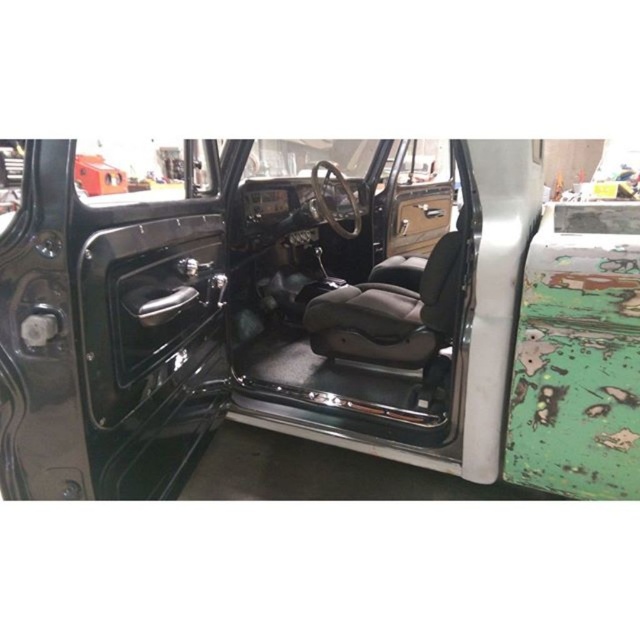
You are a mechanic working on a vintage car and need to replace the seat. The new seat you have is the same size as the current black leather door at center. Will the new seat fit in the space where the matte black seat at center is currently located?

The matte black seat at center is wider than the black leather door at center. Since the new seat is the same size as the door, it will not be wide enough to fit in the space where the matte black seat at center is located.

You are a mechanic working on a vintage car. You need to determine if the matte black seat at center can be replaced with a new seat that is 1.2 meters in width. The current space between the black leather door at center and other structures is 1.5 meters. Can the new seat fit in the space?

The matte black seat at center is larger than the black leather door at center. Since the current space between the black leather door at center and other structures is 1.5 meters, and the new seat is 1.2 meters wide, it should fit as long as the existing seat size is not exceeding the space. However, since the original seat is larger than the door, but the door is part of the structure, the exact dimensions would need verification. The answer is inconclusive without more data.

You are a mechanic inspecting the vintage car from the front passenger seat. You notice two points marked on the driver side door. One is at coordinate point (x=45, y=268) and the other is at point (x=404, y=420). Which point is nearer to your current position?

Point (x=45, y=268) is closer to the camera than point (x=404, y=420), so the point at coordinate point (x=45, y=268) is nearer to your current position.